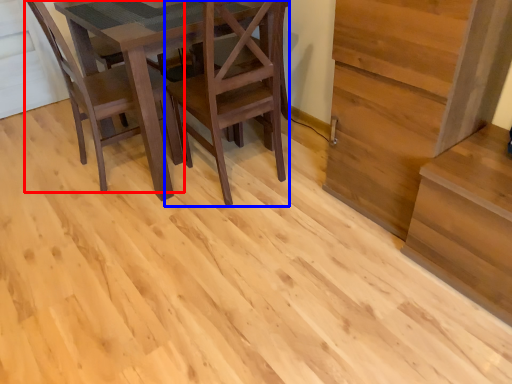
Question: Among these objects, which one is farthest to the camera, chair (highlighted by a red box) or chair (highlighted by a blue box)?

Choices:
 (A) chair
 (B) chair

Answer: (A)